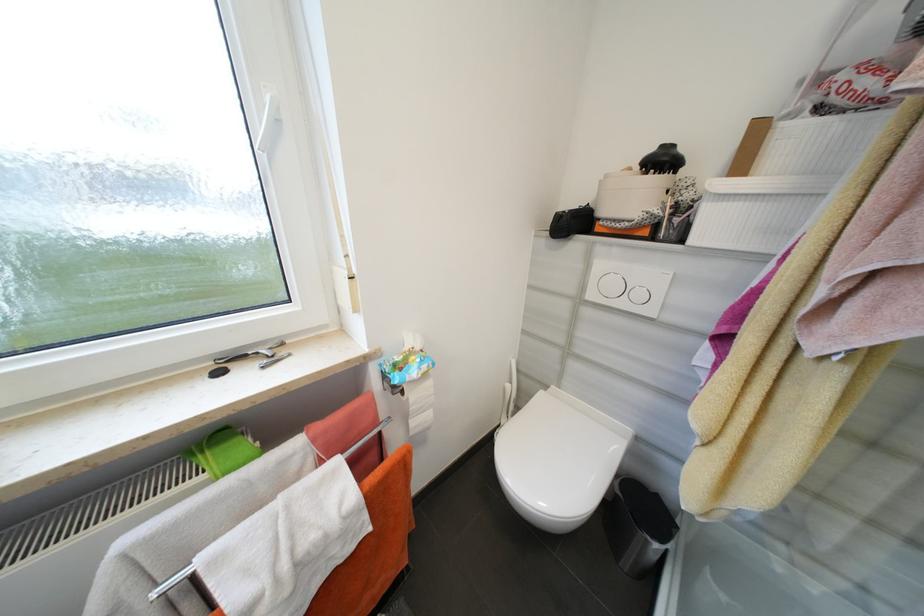
This screenshot has height=616, width=924. What are the coordinates of `white toilet brush` in the screenshot? It's located at (508, 395).